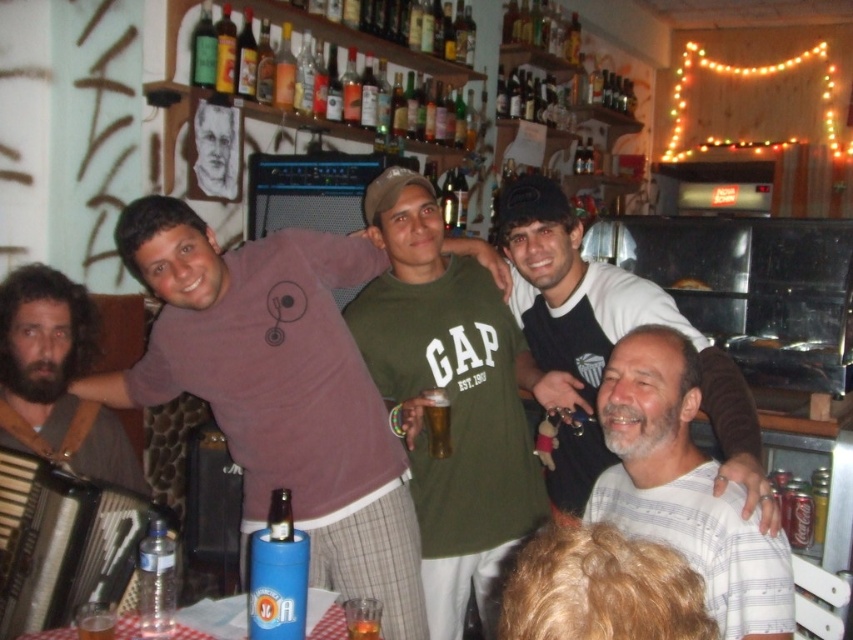
You are a photographer setting up for a group photo. You need to ensure that all shirts in the center are visible. Given that the matte purple shirt at center and the white striped shirt at center are both in the center, which shirt might require more space to accommodate its width?

The matte purple shirt at center might require more space since it is wider than the white striped shirt at center according to the description.

You are a photographer setting up for a group photo in this bar scene. You need to position a small prop between the brown leather strap at left and the green glass bottle at upper center. Based on their positions, where should you place the prop so it is between them?

The brown leather strap at left is located below the green glass bottle at upper center, so to place the prop between them, position it above the brown leather strap at left and below the green glass bottle at upper center.